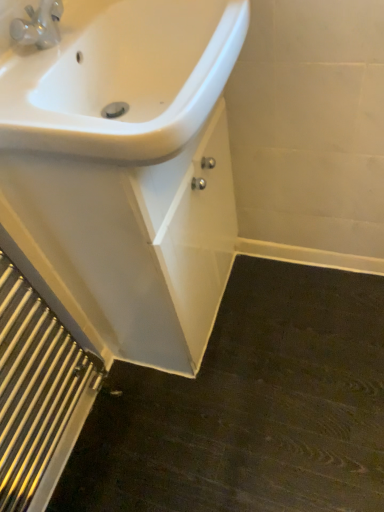
Question: Does polished silver radiator at lower left come behind white glossy sink at upper left?

Choices:
 (A) yes
 (B) no

Answer: (B)

Question: Considering the relative sizes of polished silver radiator at lower left and white glossy sink at upper left in the image provided, is polished silver radiator at lower left bigger than white glossy sink at upper left?

Choices:
 (A) yes
 (B) no

Answer: (B)

Question: Is polished silver radiator at lower left placed right next to white glossy sink at upper left?

Choices:
 (A) no
 (B) yes

Answer: (A)

Question: From the image's perspective, is polished silver radiator at lower left under white glossy sink at upper left?

Choices:
 (A) no
 (B) yes

Answer: (B)

Question: Can you confirm if polished silver radiator at lower left is thinner than white glossy sink at upper left?

Choices:
 (A) yes
 (B) no

Answer: (A)

Question: Would you consider polished silver radiator at lower left to be distant from white glossy sink at upper left?

Choices:
 (A) no
 (B) yes

Answer: (A)

Question: Considering the relative sizes of white glossy sink at upper left and polished silver radiator at lower left in the image provided, is white glossy sink at upper left taller than polished silver radiator at lower left?

Choices:
 (A) yes
 (B) no

Answer: (A)

Question: Can you confirm if white glossy sink at upper left is positioned to the left of polished silver radiator at lower left?

Choices:
 (A) no
 (B) yes

Answer: (A)

Question: Does white glossy sink at upper left have a greater width compared to polished silver radiator at lower left?

Choices:
 (A) no
 (B) yes

Answer: (B)

Question: From a real-world perspective, is white glossy sink at upper left positioned under polished silver radiator at lower left based on gravity?

Choices:
 (A) no
 (B) yes

Answer: (B)

Question: Is white glossy sink at upper left positioned with its back to polished silver radiator at lower left?

Choices:
 (A) no
 (B) yes

Answer: (A)

Question: Considering the relative sizes of white glossy sink at upper left and polished silver radiator at lower left in the image provided, is white glossy sink at upper left thinner than polished silver radiator at lower left?

Choices:
 (A) no
 (B) yes

Answer: (A)

Question: From a real-world perspective, is polished silver radiator at lower left positioned under white glossy sink at upper left based on gravity?

Choices:
 (A) no
 (B) yes

Answer: (B)